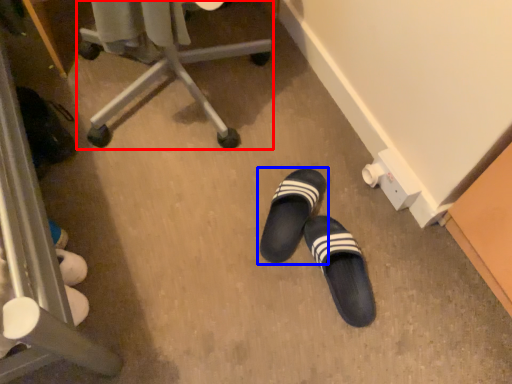
Question: Which object appears farthest to the camera in this image, furniture (highlighted by a red box) or footwear (highlighted by a blue box)?

Choices:
 (A) furniture
 (B) footwear

Answer: (B)